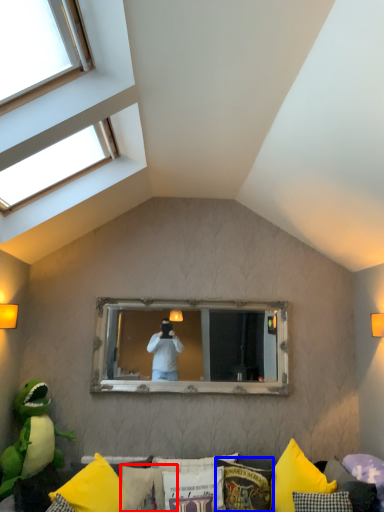
Question: Which of the following is the farthest to the observer, pillow (highlighted by a red box) or pillow (highlighted by a blue box)?

Choices:
 (A) pillow
 (B) pillow

Answer: (A)